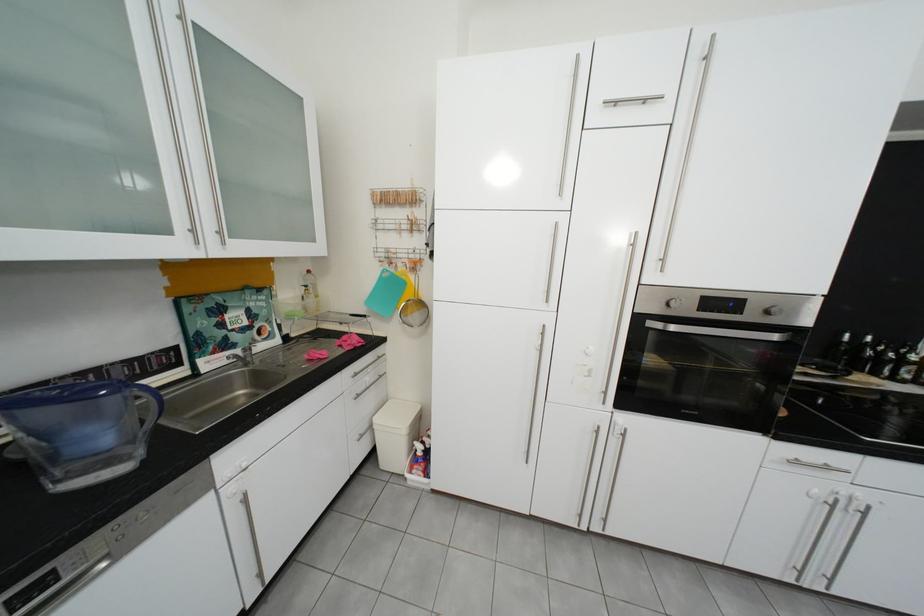
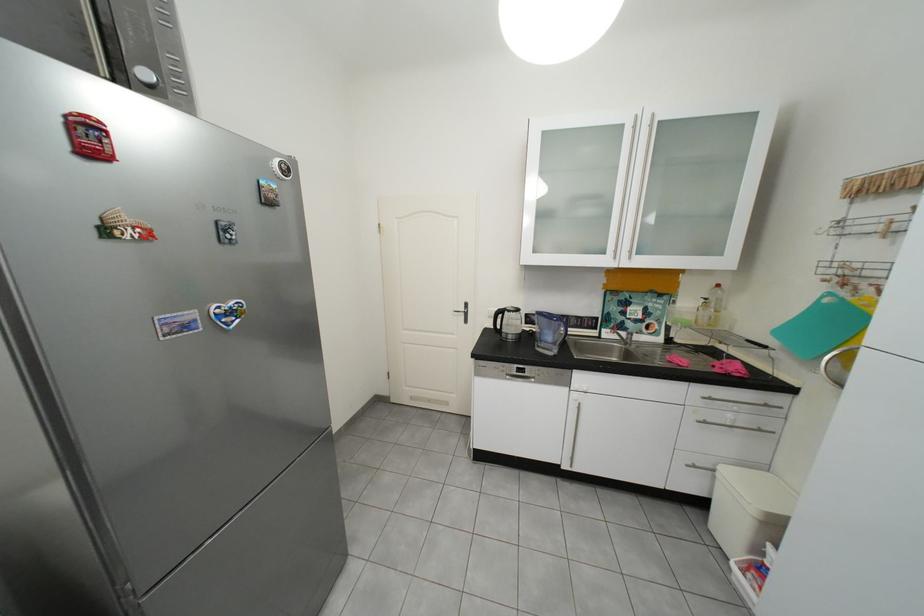
Question: The images are taken continuously from a first-person perspective. In which direction is your viewpoint rotating?

Choices:
 (A) Left
 (B) Right
 (C) Up
 (D) Down

Answer: (A)